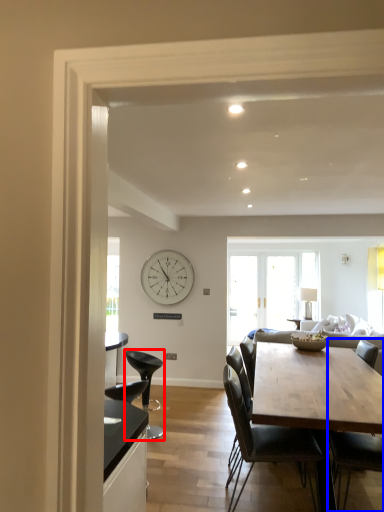
Question: Which of the following is the farthest to the observer, chair (highlighted by a red box) or chair (highlighted by a blue box)?

Choices:
 (A) chair
 (B) chair

Answer: (A)